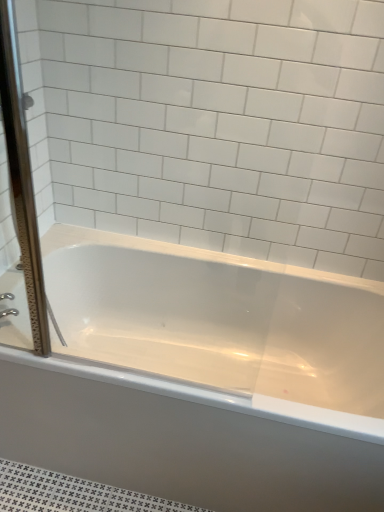
Question: From the image's perspective, is clear glass screen door at left over silver metallic faucet at left?

Choices:
 (A) yes
 (B) no

Answer: (A)

Question: Can we say clear glass screen door at left lies outside silver metallic faucet at left?

Choices:
 (A) yes
 (B) no

Answer: (A)

Question: From the image's perspective, is clear glass screen door at left beneath silver metallic faucet at left?

Choices:
 (A) yes
 (B) no

Answer: (B)

Question: Is clear glass screen door at left behind silver metallic faucet at left?

Choices:
 (A) no
 (B) yes

Answer: (A)

Question: From a real-world perspective, is clear glass screen door at left physically below silver metallic faucet at left?

Choices:
 (A) yes
 (B) no

Answer: (B)

Question: Is silver metallic faucet at left inside clear glass screen door at left?

Choices:
 (A) no
 (B) yes

Answer: (A)

Question: Is silver metallic faucet at left to the left of white glossy bathtub at center from the viewer's perspective?

Choices:
 (A) yes
 (B) no

Answer: (A)

Question: Is silver metallic faucet at left positioned behind white glossy bathtub at center?

Choices:
 (A) yes
 (B) no

Answer: (A)

Question: Can you confirm if silver metallic faucet at left is smaller than white glossy bathtub at center?

Choices:
 (A) no
 (B) yes

Answer: (B)

Question: Is silver metallic faucet at left thinner than white glossy bathtub at center?

Choices:
 (A) yes
 (B) no

Answer: (A)

Question: Is silver metallic faucet at left bigger than white glossy bathtub at center?

Choices:
 (A) no
 (B) yes

Answer: (A)

Question: From a real-world perspective, does silver metallic faucet at left sit lower than white glossy bathtub at center?

Choices:
 (A) no
 (B) yes

Answer: (A)

Question: Considering the relative positions of silver metallic faucet at left and clear glass screen door at left in the image provided, is silver metallic faucet at left to the right of clear glass screen door at left from the viewer's perspective?

Choices:
 (A) yes
 (B) no

Answer: (B)